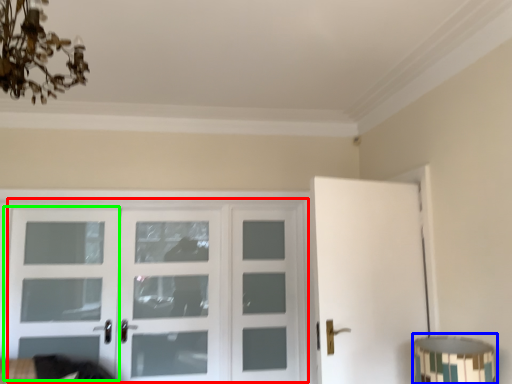
Question: Based on their relative distances, which object is nearer to door (highlighted by a red box)? Choose from table lamp (highlighted by a blue box) and screen door (highlighted by a green box).

Choices:
 (A) table lamp
 (B) screen door

Answer: (B)